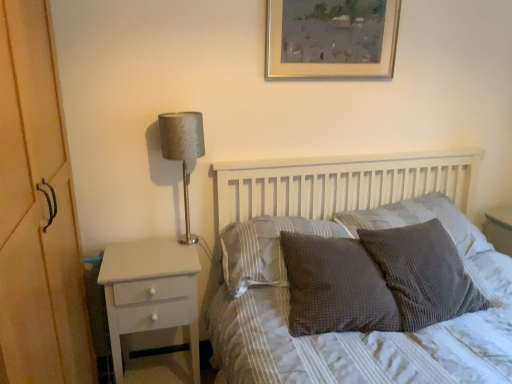
Question: From the image's perspective, is white painted wood nightstand at left located beneath waffle-textured gray pillow at center-right, acting as the second pillow starting from the right?

Choices:
 (A) no
 (B) yes

Answer: (B)

Question: From a real-world perspective, is white painted wood nightstand at left below waffle-textured gray pillow at center-right, acting as the second pillow starting from the right?

Choices:
 (A) no
 (B) yes

Answer: (B)

Question: Is white painted wood nightstand at left positioned far away from waffle-textured gray pillow at center-right, acting as the second pillow starting from the right?

Choices:
 (A) yes
 (B) no

Answer: (B)

Question: Does white painted wood nightstand at left have a smaller size compared to waffle-textured gray pillow at center-right, acting as the second pillow starting from the right?

Choices:
 (A) no
 (B) yes

Answer: (A)

Question: Is white painted wood nightstand at left completely or partially outside of waffle-textured gray pillow at center-right, the 3th pillow when ordered from left to right?

Choices:
 (A) no
 (B) yes

Answer: (B)

Question: Is white painted wood nightstand at left further to camera compared to waffle-textured gray pillow at center-right, the 3th pillow when ordered from left to right?

Choices:
 (A) no
 (B) yes

Answer: (B)

Question: Can you confirm if white painted wood nightstand at left is positioned to the right of satin silver lamp at left?

Choices:
 (A) no
 (B) yes

Answer: (A)

Question: Could you tell me if white painted wood nightstand at left is turned towards satin silver lamp at left?

Choices:
 (A) no
 (B) yes

Answer: (A)

Question: From a real-world perspective, is white painted wood nightstand at left located beneath satin silver lamp at left?

Choices:
 (A) no
 (B) yes

Answer: (B)

Question: Is white painted wood nightstand at left taller than satin silver lamp at left?

Choices:
 (A) no
 (B) yes

Answer: (B)

Question: Is satin silver lamp at left a part of white painted wood nightstand at left?

Choices:
 (A) no
 (B) yes

Answer: (A)

Question: Would you consider white painted wood nightstand at left to be distant from satin silver lamp at left?

Choices:
 (A) no
 (B) yes

Answer: (A)

Question: Does satin silver lamp at left lie behind textured gray pillow at center, marked as the 2th pillow in a left-to-right arrangement?

Choices:
 (A) no
 (B) yes

Answer: (B)